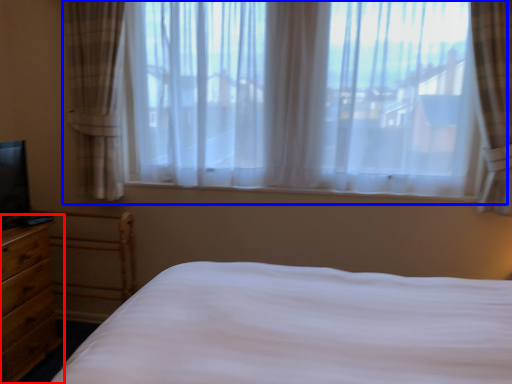
Question: Which of the following is the farthest to the observer, nightstand (highlighted by a red box) or window (highlighted by a blue box)?

Choices:
 (A) nightstand
 (B) window

Answer: (B)